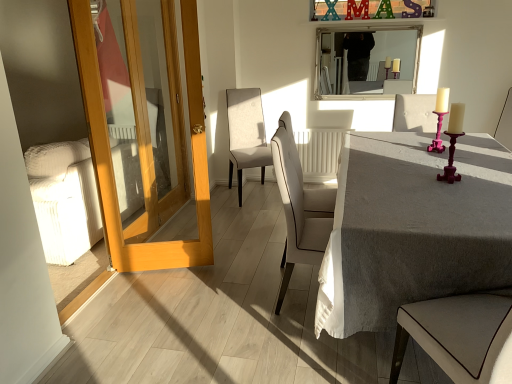
At what (x,y) coordinates should I click in order to perform the action: click on vacant area in front of white leather chair at center, which ranks as the 3th chair in back-to-front order. Please return your answer as a coordinate pair (x, y). Looking at the image, I should click on (324, 354).